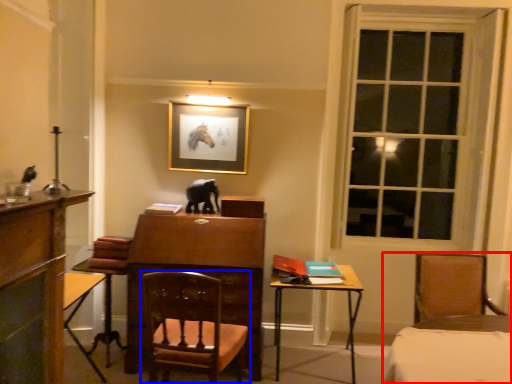
Question: Among these objects, which one is farthest to the camera, chair (highlighted by a red box) or chair (highlighted by a blue box)?

Choices:
 (A) chair
 (B) chair

Answer: (A)